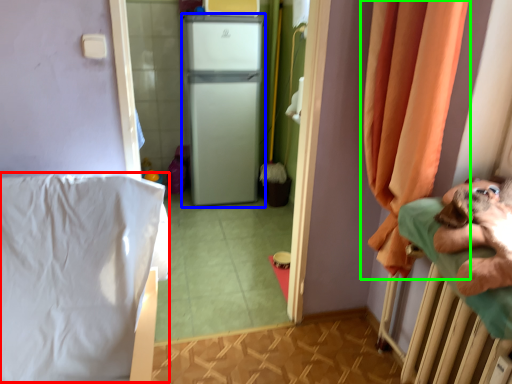
Question: Which object is positioned farthest from sheet (highlighted by a red box)? Select from appliance (highlighted by a blue box) and curtain (highlighted by a green box).

Choices:
 (A) appliance
 (B) curtain

Answer: (A)